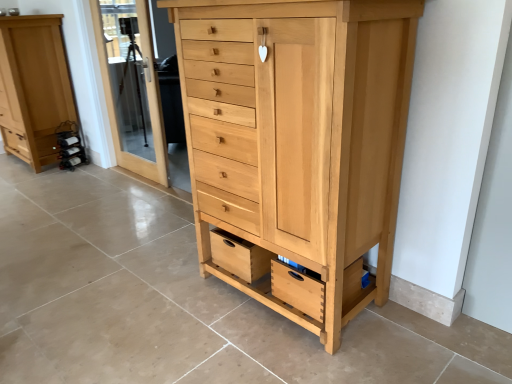
Question: In the image, is transparent glass door at upper left on the left side or the right side of natural wood chest of drawers at center, which is the first chest of drawers in front-to-back order?

Choices:
 (A) left
 (B) right

Answer: (A)

Question: From their relative heights in the image, would you say transparent glass door at upper left is taller or shorter than natural wood chest of drawers at center, which is the first chest of drawers in front-to-back order?

Choices:
 (A) tall
 (B) short

Answer: (A)

Question: Based on their relative distances, which object is nearer to the natural wood chest of drawers at center, acting as the second chest of drawers starting from the back?

Choices:
 (A) transparent glass door at upper left
 (B) natural wood drawer at lower center
 (C) natural wood cabinet at left, positioned as the 2th chest of drawers in front-to-back order

Answer: (B)

Question: Estimate the real-world distances between objects in this image. Which object is closer to the transparent glass door at upper left?

Choices:
 (A) natural wood chest of drawers at center, marked as the first chest of drawers in a right-to-left arrangement
 (B) natural wood cabinet at left, the 1th chest of drawers viewed from the left
 (C) natural wood drawer at lower center

Answer: (B)